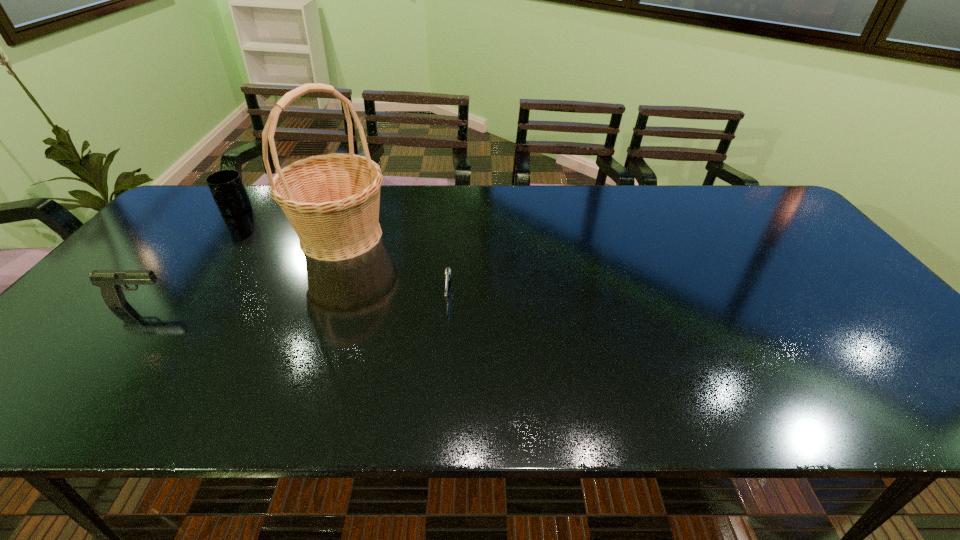
Find the location of `free spot that satisfies the following two spatial constraints: 1. on the front-facing side of the rightmost object; 2. aim along the barrel of the taller pistol`. free spot that satisfies the following two spatial constraints: 1. on the front-facing side of the rightmost object; 2. aim along the barrel of the taller pistol is located at coordinates (447, 303).

I want to click on free location that satisfies the following two spatial constraints: 1. on the side of the mug with the handle; 2. on the right side of the third object from left to right, so click(215, 236).

Where is `blank space that satisfies the following two spatial constraints: 1. on the side of the mug with the handle; 2. on the left side of the basket`? The width and height of the screenshot is (960, 540). blank space that satisfies the following two spatial constraints: 1. on the side of the mug with the handle; 2. on the left side of the basket is located at coordinates (215, 236).

In order to click on vacant region that satisfies the following two spatial constraints: 1. on the side of the third object from left to right with the handle; 2. on the left side of the mug in this screenshot , I will do `click(215, 236)`.

This screenshot has height=540, width=960. What are the coordinates of `free space that satisfies the following two spatial constraints: 1. on the front-facing side of the right pistol; 2. aim along the barrel of the left pistol` in the screenshot? It's located at (447, 303).